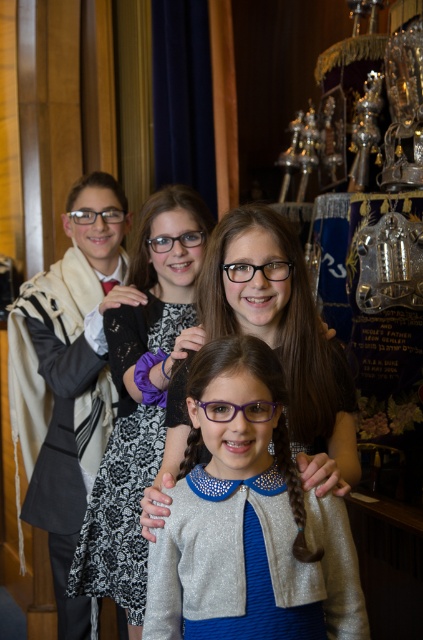
Between shiny silver cardigan at center and purple plastic glasses at center, which one is positioned higher?

purple plastic glasses at center

Between shiny silver cardigan at center and purple plastic glasses at center, which one is positioned lower?

shiny silver cardigan at center

Is point (274, 356) farther from camera compared to point (260, 401)?

That is True.

Locate an element on the screen. The height and width of the screenshot is (640, 423). shiny silver cardigan at center is located at coordinates [249, 524].

You are a GUI agent. You are given a task and a screenshot of the screen. Output one action in this format:
    pyautogui.click(x=<x>, y=<y>)
    Task: Click on the black lace dress at center
    The height and width of the screenshot is (640, 423).
    Given the screenshot: What is the action you would take?
    pyautogui.click(x=126, y=461)

Consider the image. Which of these two, black lace dress at center or purple plastic glasses at center, stands taller?

With more height is black lace dress at center.

What do you see at coordinates (126, 461) in the screenshot? I see `black lace dress at center` at bounding box center [126, 461].

Locate an element on the screen. The width and height of the screenshot is (423, 640). black lace dress at center is located at coordinates (126, 461).

Who is more distant from viewer, (200,627) or (125,461)?

Point (125,461)

Can you confirm if shiny silver cardigan at center is positioned to the left of black lace dress at center?

Incorrect, shiny silver cardigan at center is not on the left side of black lace dress at center.

Who is more forward, (181, 490) or (102, 465)?

Point (181, 490) is in front.

Where is `shiny silver cardigan at center`? Image resolution: width=423 pixels, height=640 pixels. shiny silver cardigan at center is located at coordinates (249, 524).